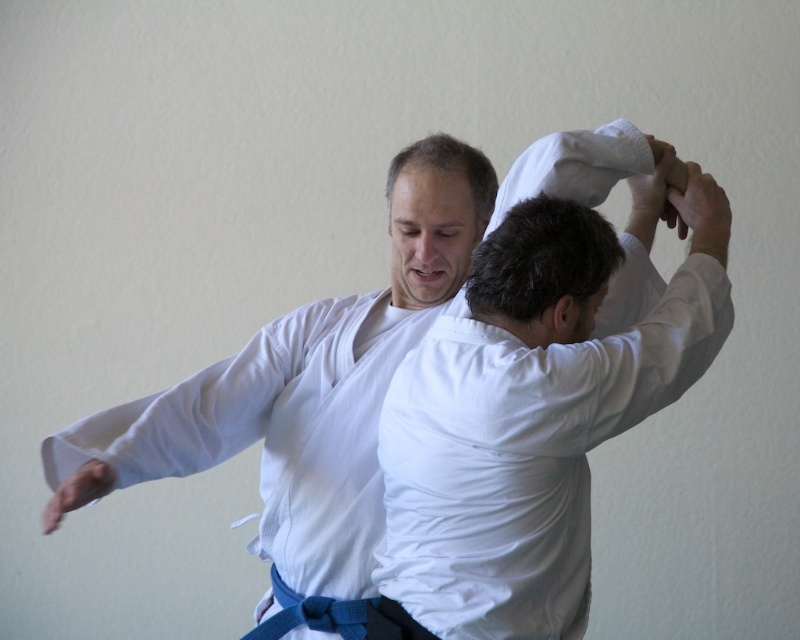
Is white cotton kimono at center above white cotton shirt at center?

Correct, white cotton kimono at center is located above white cotton shirt at center.

What do you see at coordinates (333, 365) in the screenshot?
I see `white cotton kimono at center` at bounding box center [333, 365].

The height and width of the screenshot is (640, 800). Find the location of `white cotton kimono at center`. white cotton kimono at center is located at coordinates (333, 365).